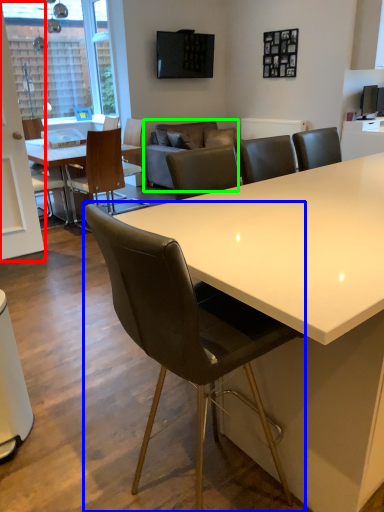
Question: Which object is the closest to the glass door (highlighted by a red box)? Choose among these: chair (highlighted by a blue box) or couch (highlighted by a green box).

Choices:
 (A) chair
 (B) couch

Answer: (B)